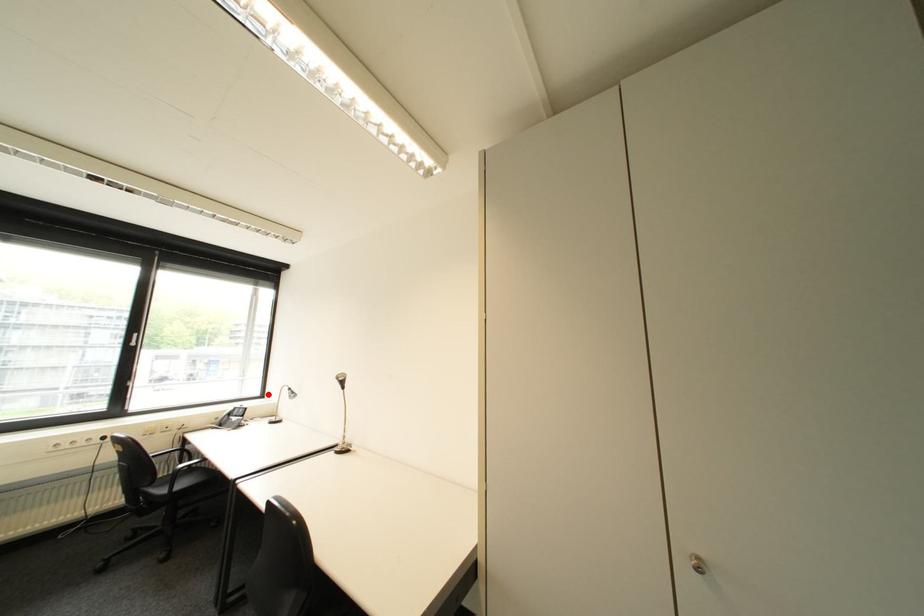
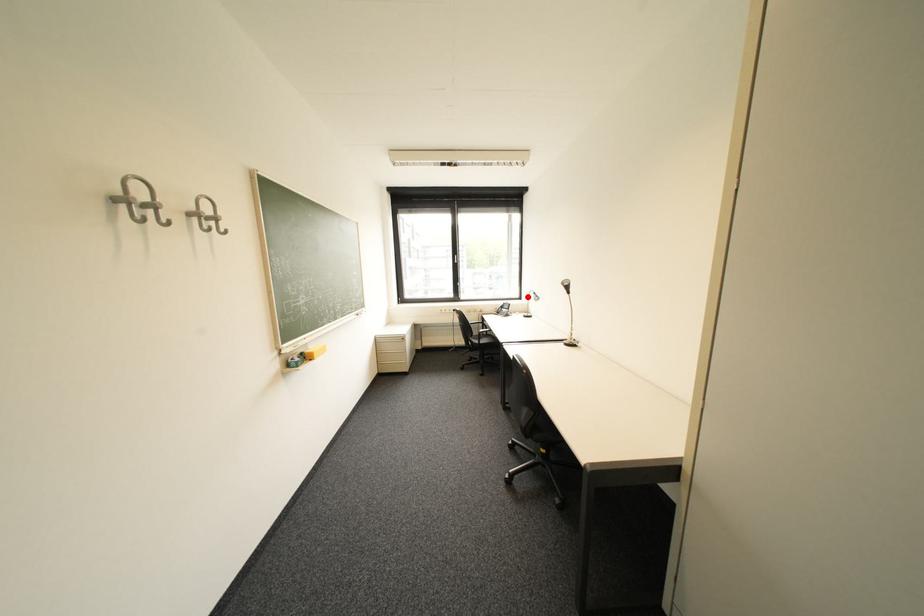
I am providing you with two images of the same scene from different viewpoints. A red point is marked on the first image and another point is marked on the second image. Are the points marked in image1 and image2 representing the same 3D position?

Yes